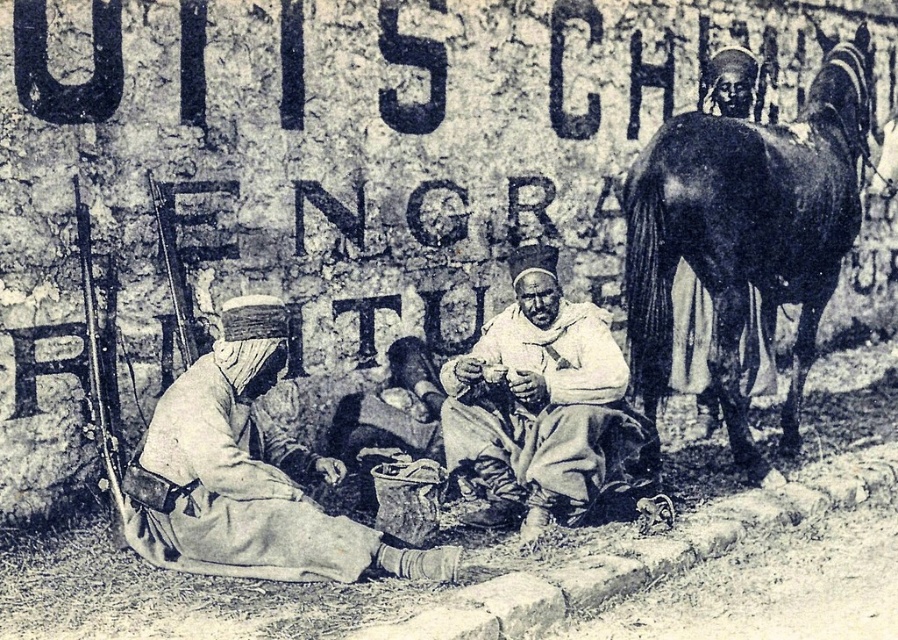
Question: Based on their relative distances, which object is nearer to the dark brown glossy horse at right?

Choices:
 (A) white clothed man at center
 (B) light beige fabric at center

Answer: (A)

Question: Observing the image, what is the correct spatial positioning of dark brown glossy horse at right in reference to light beige fabric at center?

Choices:
 (A) above
 (B) below

Answer: (A)

Question: Does light beige fabric at center have a lesser width compared to white clothed man at center?

Choices:
 (A) yes
 (B) no

Answer: (B)

Question: Which object is farther from the camera taking this photo?

Choices:
 (A) dark brown glossy horse at right
 (B) white clothed man at center
 (C) light beige fabric at center

Answer: (A)

Question: Can you confirm if dark brown glossy horse at right is positioned to the left of light beige fabric at center?

Choices:
 (A) no
 (B) yes

Answer: (A)

Question: Which object appears closest to the camera in this image?

Choices:
 (A) white clothed man at center
 (B) light beige fabric at center

Answer: (B)